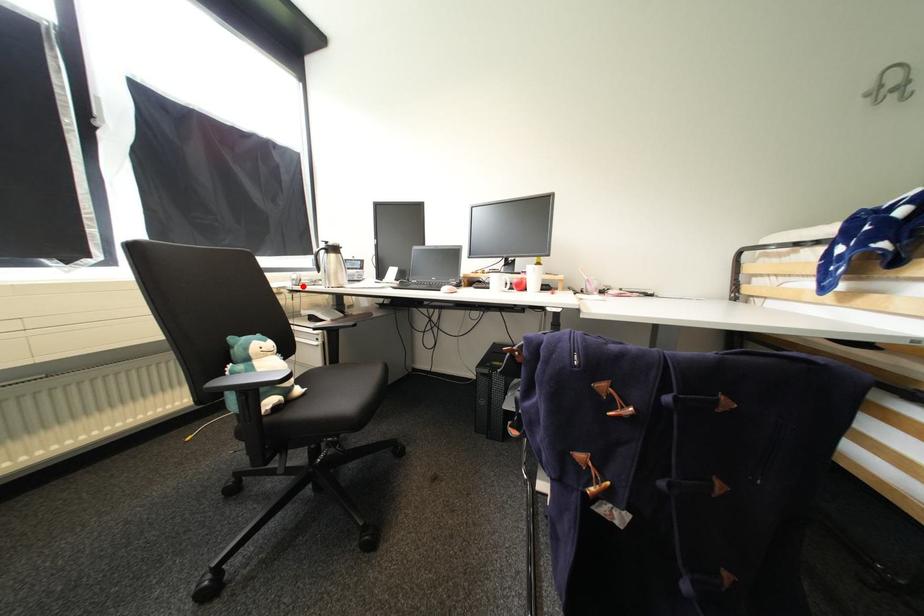
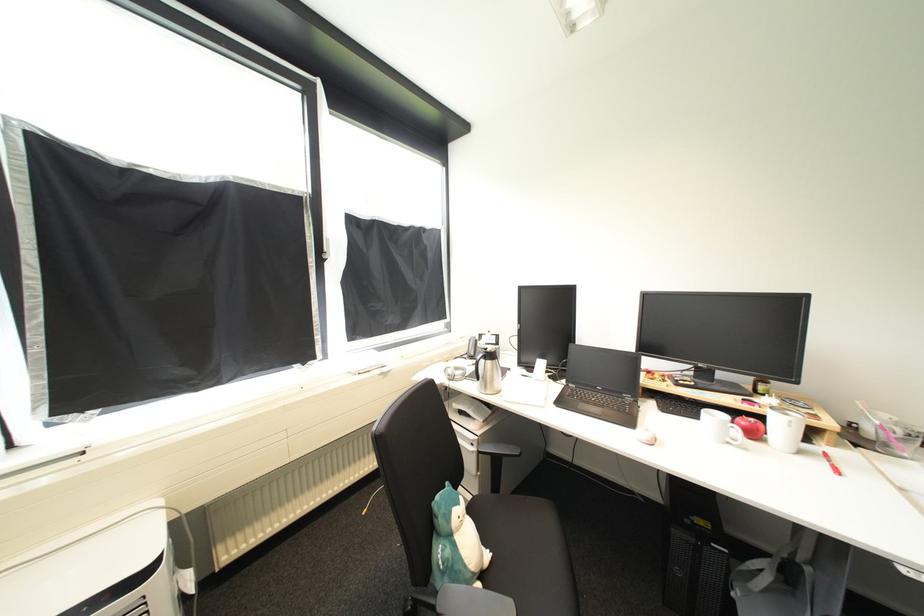
The point at the highlighted location is marked in the first image. Where is the corresponding point in the second image?

(456, 381)